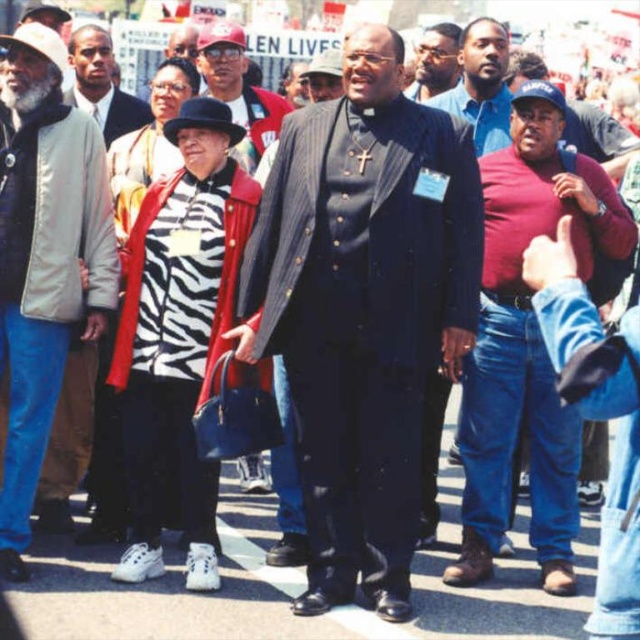
Question: Is matte red shirt at center behind matte black suit at upper center?

Choices:
 (A) yes
 (B) no

Answer: (B)

Question: Can you confirm if dark skin smooth face at upper left is positioned to the left of matte black suit at upper center?

Choices:
 (A) no
 (B) yes

Answer: (B)

Question: Among these points, which one is farthest from the camera?

Choices:
 (A) (440, 83)
 (B) (86, 241)
 (C) (337, 388)

Answer: (A)

Question: Which of the following is the farthest from the observer?

Choices:
 (A) (70, 49)
 (B) (529, 413)

Answer: (A)

Question: Observing the image, what is the correct spatial positioning of dark skin smooth face at upper left in reference to matte black suit at upper center?

Choices:
 (A) left
 (B) right

Answer: (A)

Question: Which point appears farthest from the camera in this image?

Choices:
 (A) (426, 80)
 (B) (509, 278)
 (C) (376, 188)

Answer: (A)